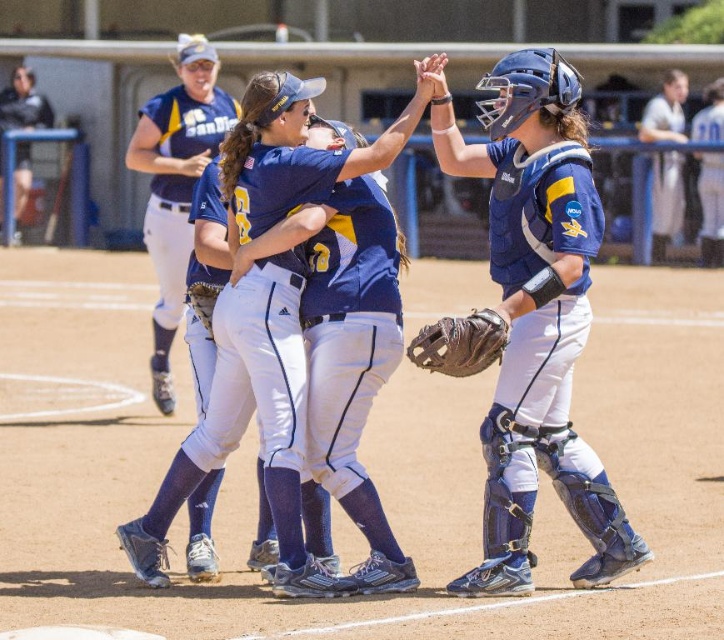
Between point (568, 72) and point (466, 356), which one is positioned in front?

Point (466, 356)

Is blue matte catcher at center to the right of brown leather glove at lower center from the viewer's perspective?

Correct, you'll find blue matte catcher at center to the right of brown leather glove at lower center.

The width and height of the screenshot is (724, 640). I want to click on blue matte catcher at center, so click(x=530, y=317).

Which of these two, matte blue jersey at center or blue matte catcher at center, stands taller?

With more height is matte blue jersey at center.

Does matte blue jersey at center come in front of blue matte catcher at center?

No, matte blue jersey at center is further to the viewer.

What do you see at coordinates (536, 316) in the screenshot?
I see `matte blue jersey at center` at bounding box center [536, 316].

Find the location of a particular element. The height and width of the screenshot is (640, 724). matte blue jersey at center is located at coordinates (536, 316).

Is the position of matte blue jersey at center more distant than that of brown leather glove at lower center?

Yes, matte blue jersey at center is behind brown leather glove at lower center.

Who is positioned more to the left, matte blue jersey at center or brown leather glove at lower center?

Positioned to the left is brown leather glove at lower center.

Does point (484, 154) lie behind point (492, 339)?

Yes, point (484, 154) is farther from viewer.

Identify the location of matte blue jersey at center. This screenshot has width=724, height=640. (536, 316).